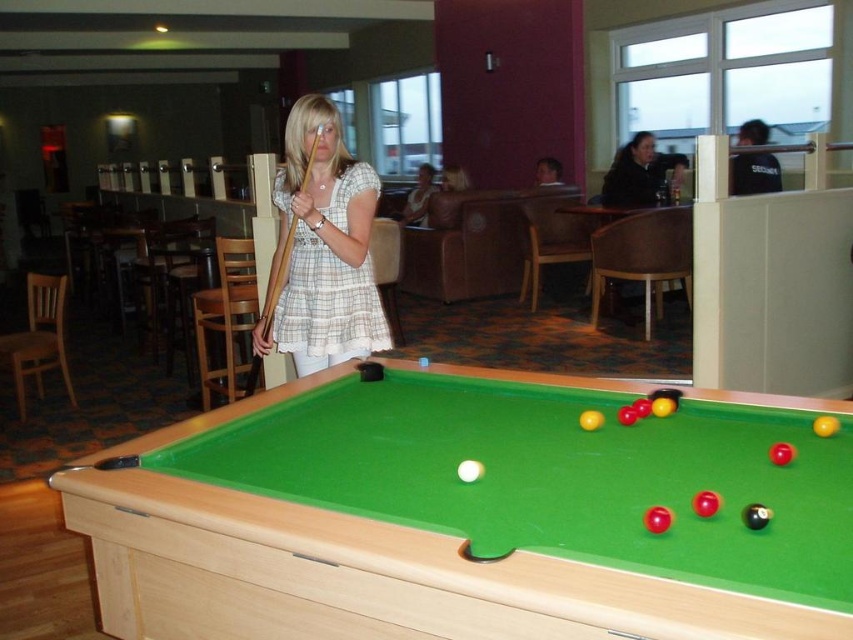
Question: Does plaid fabric shirt at center come in front of wooden at left?

Choices:
 (A) no
 (B) yes

Answer: (A)

Question: From the image, what is the correct spatial relationship of wooden at left in relation to plaid fabric dress at center?

Choices:
 (A) below
 (B) above

Answer: (A)

Question: Which point is farther to the camera?

Choices:
 (A) (289, 116)
 (B) (683, 554)

Answer: (A)

Question: Among these points, which one is nearest to the camera?

Choices:
 (A) (416, 182)
 (B) (848, 490)
 (C) (271, 289)

Answer: (B)

Question: Can you confirm if wooden at left is smaller than plaid fabric dress at center?

Choices:
 (A) no
 (B) yes

Answer: (B)

Question: Among these objects, which one is nearest to the camera?

Choices:
 (A) wooden at left
 (B) plaid fabric shirt at center
 (C) plaid fabric dress at center

Answer: (A)